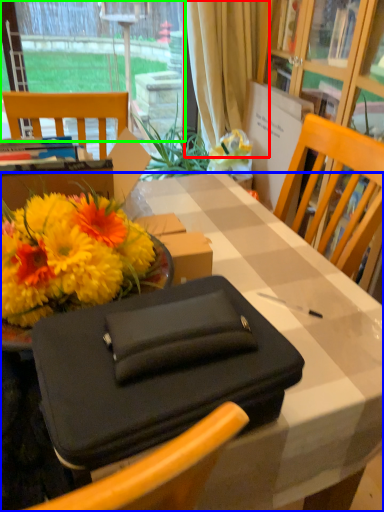
Question: Considering the real-world distances, which object is farthest from curtain (highlighted by a red box)? desk (highlighted by a blue box) or window (highlighted by a green box)?

Choices:
 (A) desk
 (B) window

Answer: (A)